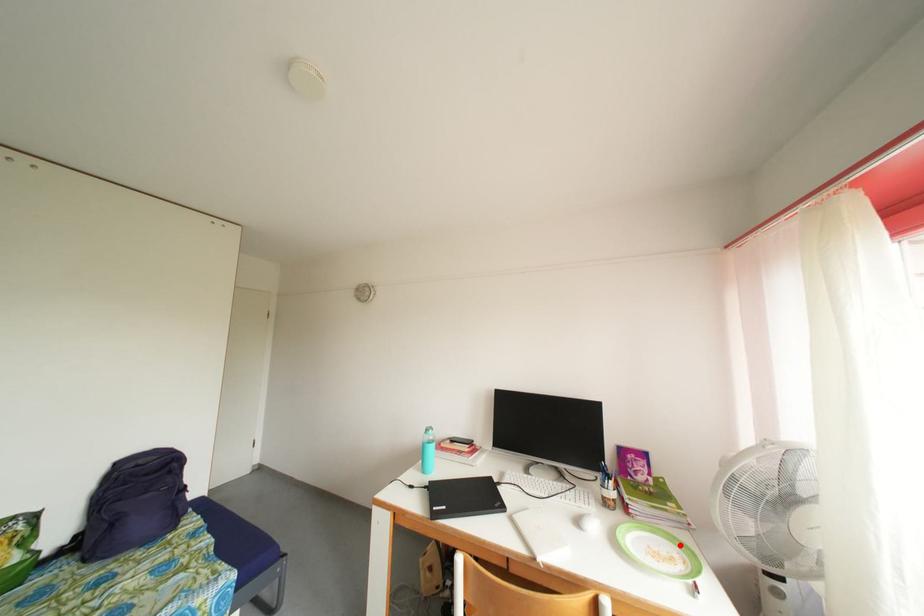
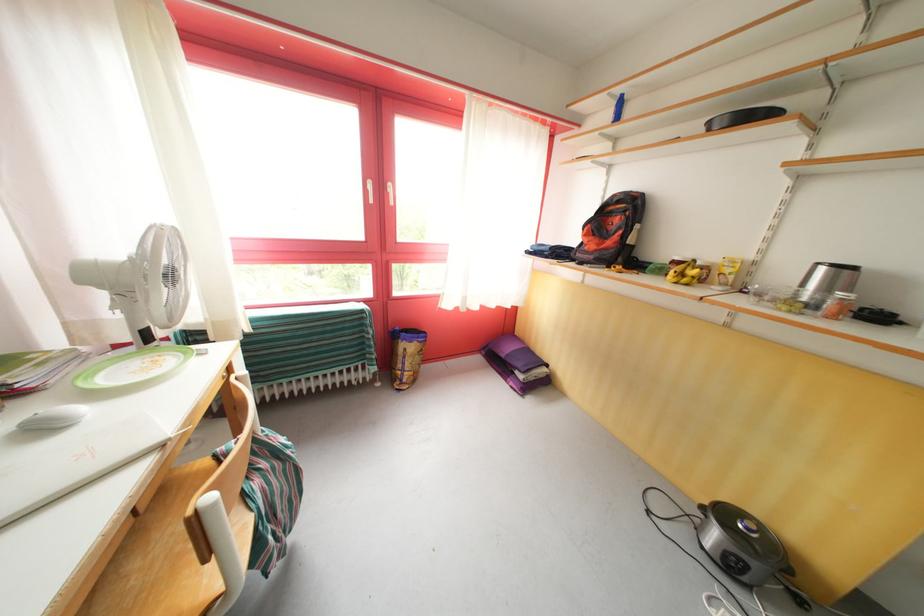
Where in the second image is the point corresponding to the highlighted location from the first image?

(128, 363)